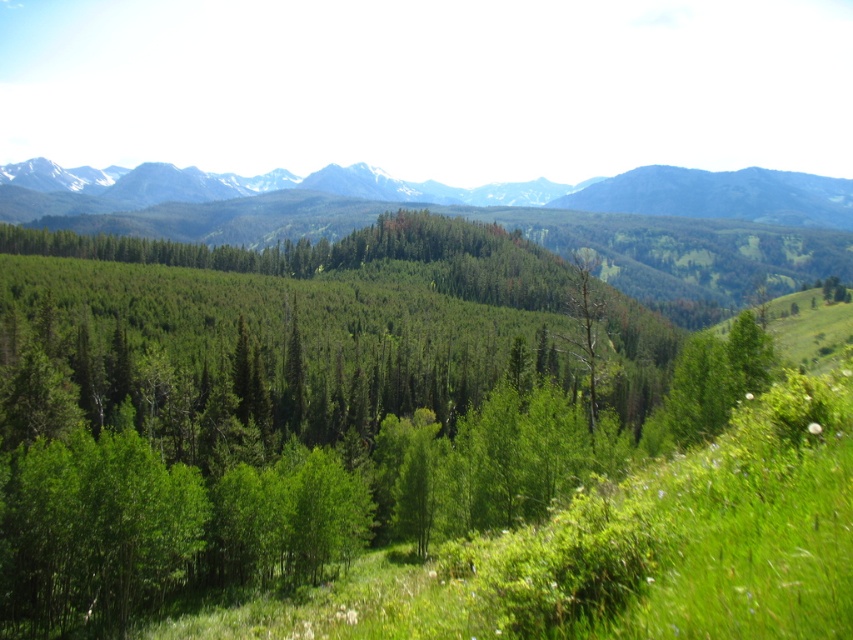
Which is below, green leafy tree at center or snowy rocky mountain range at upper center?

green leafy tree at center

What do you see at coordinates (305, 408) in the screenshot?
I see `green leafy tree at center` at bounding box center [305, 408].

Is point (215, 314) positioned behind point (813, 184)?

No.

At what (x,y) coordinates should I click in order to perform the action: click on green leafy tree at center. Please return your answer as a coordinate pair (x, y). The height and width of the screenshot is (640, 853). Looking at the image, I should click on (305, 408).

Is snowy rocky mountain range at upper center positioned behind dead wood tree at center?

Yes, snowy rocky mountain range at upper center is behind dead wood tree at center.

Can you confirm if snowy rocky mountain range at upper center is bigger than dead wood tree at center?

Correct, snowy rocky mountain range at upper center is larger in size than dead wood tree at center.

Is point (816, 214) positioned in front of point (585, 342)?

That is False.

Locate an element on the screen. snowy rocky mountain range at upper center is located at coordinates (457, 192).

Who is positioned more to the right, green leafy tree at center or dead wood tree at center?

From the viewer's perspective, dead wood tree at center appears more on the right side.

Is green leafy tree at center thinner than dead wood tree at center?

No, green leafy tree at center is not thinner than dead wood tree at center.

The width and height of the screenshot is (853, 640). What are the coordinates of `green leafy tree at center` in the screenshot? It's located at (305, 408).

Locate an element on the screen. This screenshot has width=853, height=640. green leafy tree at center is located at coordinates (305, 408).